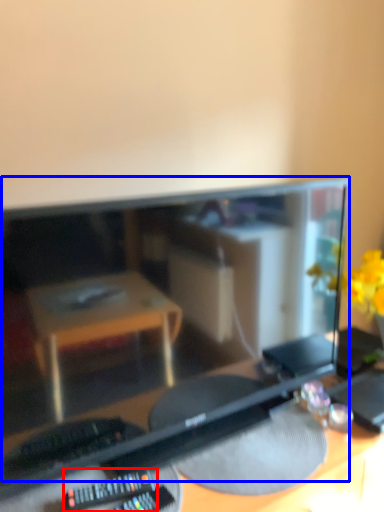
Question: Which object appears closest to the camera in this image, control (highlighted by a red box) or computer monitor (highlighted by a blue box)?

Choices:
 (A) control
 (B) computer monitor

Answer: (B)